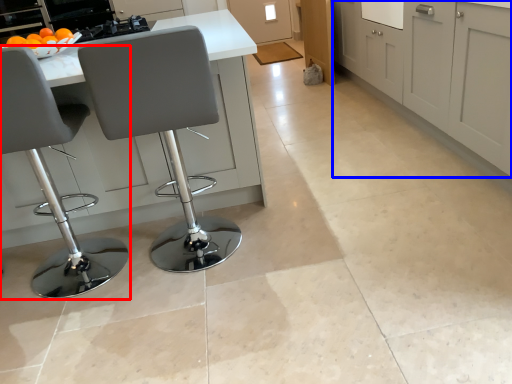
Question: Which object is further to the camera taking this photo, chair (highlighted by a red box) or cabinetry (highlighted by a blue box)?

Choices:
 (A) chair
 (B) cabinetry

Answer: (B)